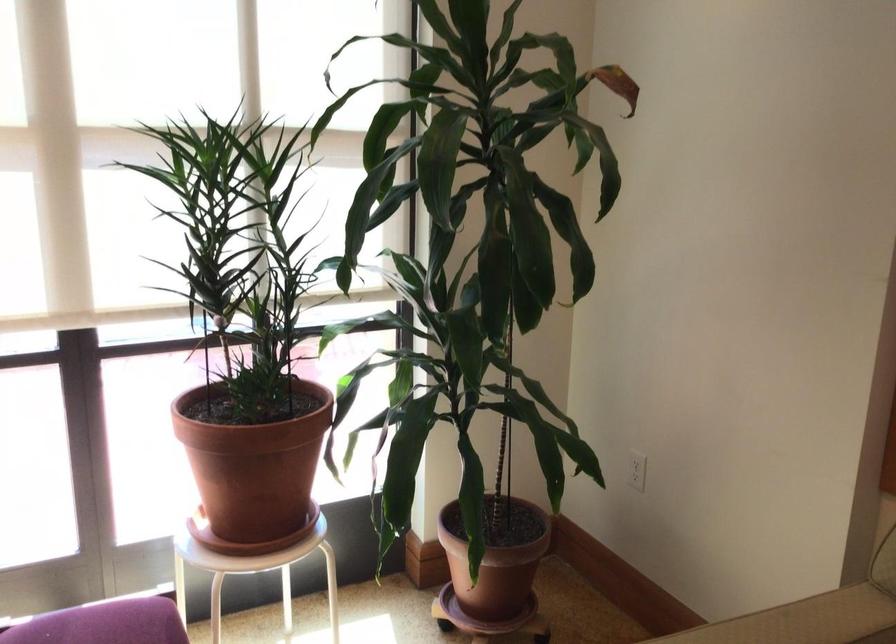
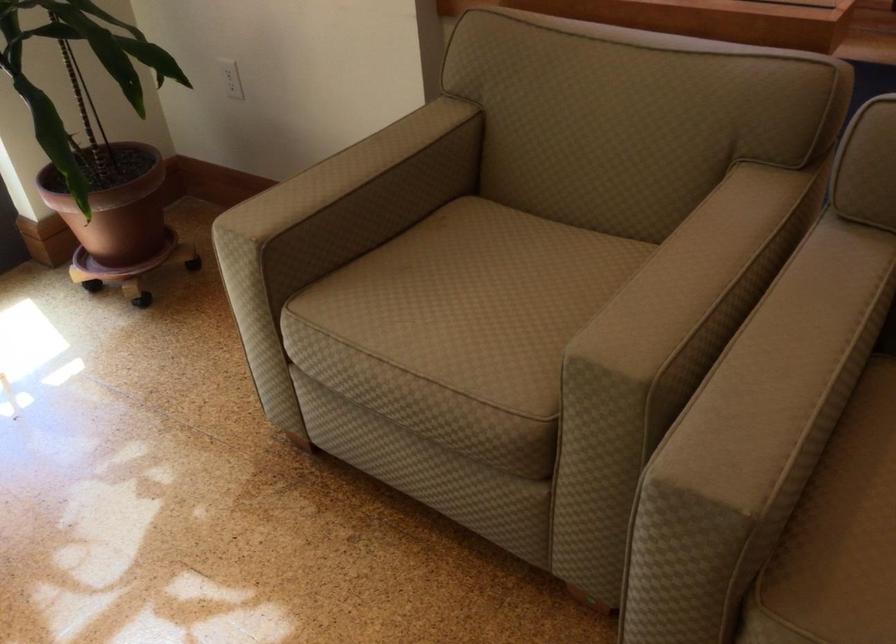
The images are taken continuously from a first-person perspective. In which direction is your viewpoint rotating?

The camera rotated toward right-down.